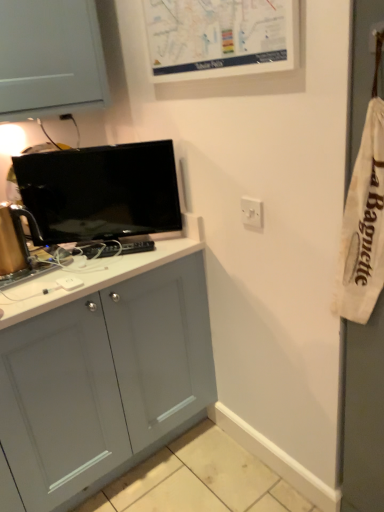
Question: From the image's perspective, is white matte map at upper center above or below white plastic switch at upper right?

Choices:
 (A) above
 (B) below

Answer: (A)

Question: Is white matte map at upper center bigger or smaller than white plastic switch at upper right?

Choices:
 (A) big
 (B) small

Answer: (A)

Question: Estimate the real-world distances between objects in this image. Which object is farther from the white plastic switch at upper right?

Choices:
 (A) white matte map at upper center
 (B) matte black tv at upper left

Answer: (B)

Question: Which of these objects is positioned farthest from the matte black tv at upper left?

Choices:
 (A) white plastic switch at upper right
 (B) white matte map at upper center

Answer: (A)